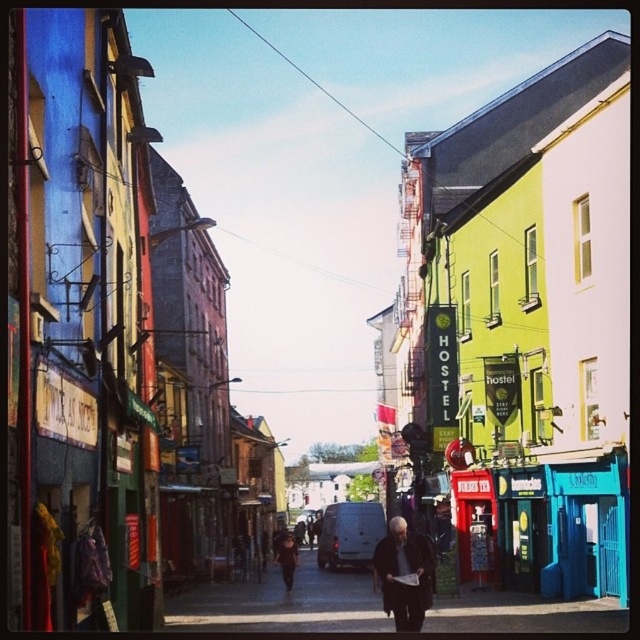
You are standing at the point labeled point (525,604) and want to walk to the van parked near the center of the street. The van is 29.88 meters away from you. If you can walk at a speed of 1.5 meters per second, how many seconds will it take you to reach the van?

The distance between you and the van is 29.88 meters, and your walking speed is 1.5 meters per second. To calculate the time required, divide the distance by the speed. 29.88 meters divided by 1.5 meters per second equals approximately 19.92 seconds. Therefore, it will take approximately 20 seconds to reach the van.

You are a delivery person trying to park your van in the street. You see the smooth asphalt road at center and the dark brown leather jacket at center. Which object is higher up from the ground?

The smooth asphalt road at center is much taller than the dark brown leather jacket at center, so the smooth asphalt road at center is higher up from the ground.